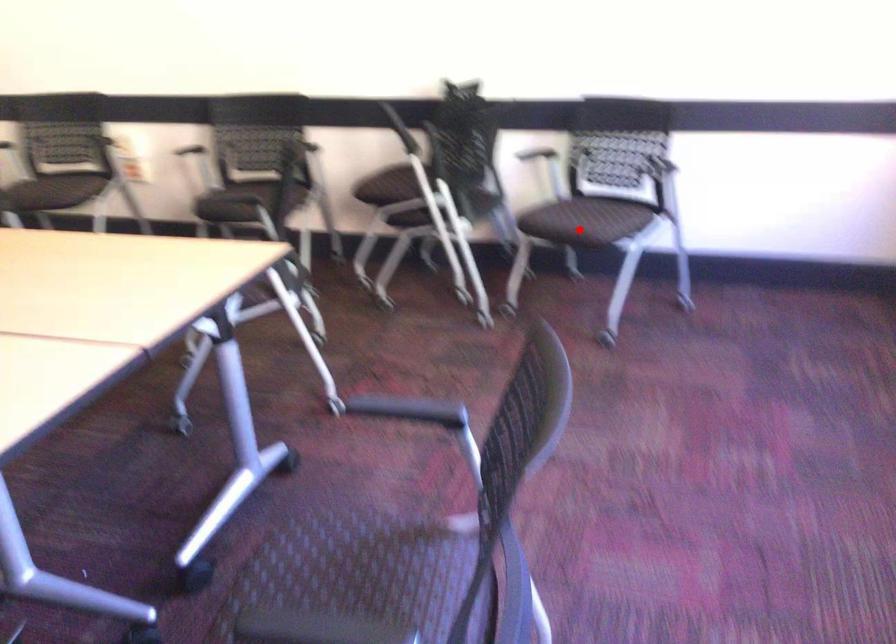
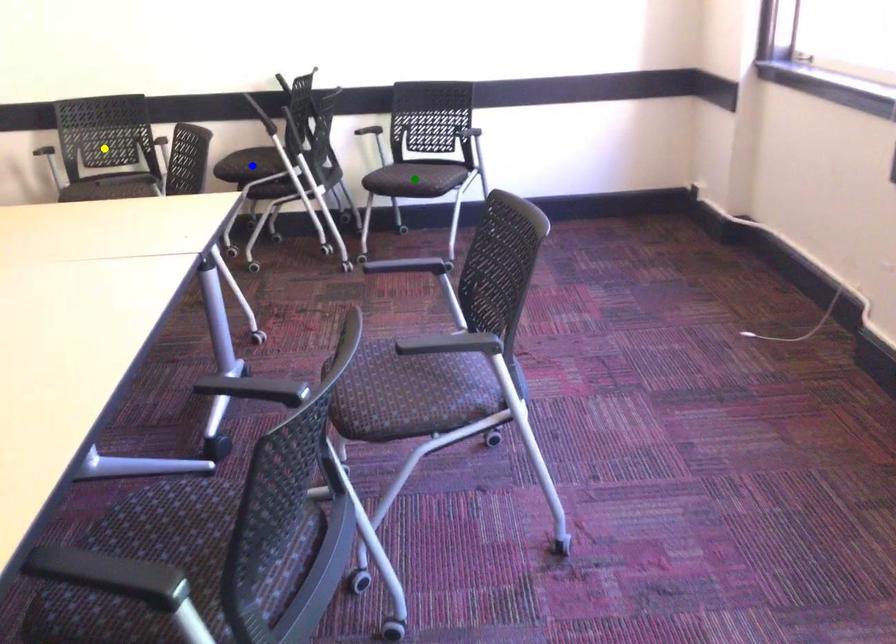
Question: I am providing you with two images of the same scene from different viewpoints. A red point is marked on the first image. You are given multiple points on the second image. In image 2, which mark is for the same physical point as the one in image 1?

Choices:
 (A) green point
 (B) yellow point
 (C) blue point

Answer: (A)